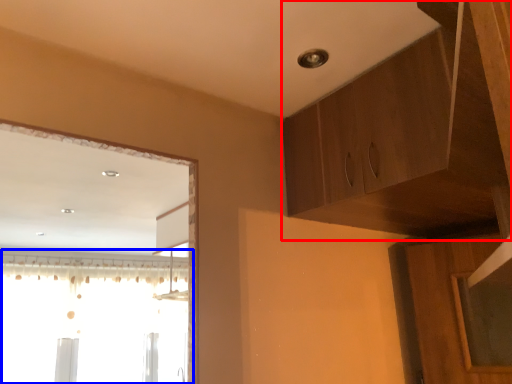
Question: Which object appears closest to the camera in this image, cabinetry (highlighted by a red box) or window (highlighted by a blue box)?

Choices:
 (A) cabinetry
 (B) window

Answer: (A)